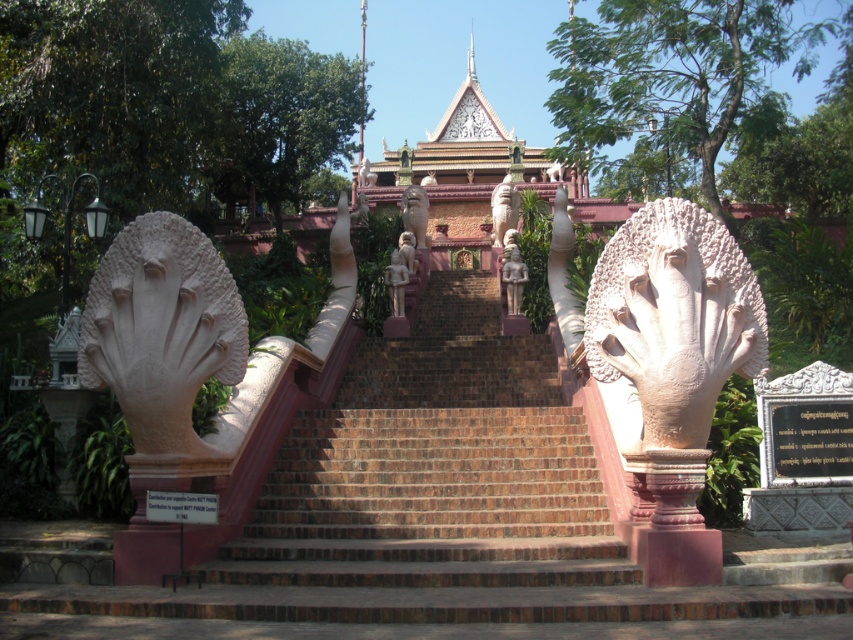
Question: Does polished bronze temple at center come behind white stone statue at center?

Choices:
 (A) yes
 (B) no

Answer: (A)

Question: Is brick stairs at center bigger than smooth stone statue at center?

Choices:
 (A) no
 (B) yes

Answer: (B)

Question: Estimate the real-world distances between objects in this image. Which object is closer to the brick stairs at center?

Choices:
 (A) smooth stone statue at center
 (B) stone statue at center

Answer: (B)

Question: Does brick stairs at center have a smaller size compared to smooth stone statue at center?

Choices:
 (A) no
 (B) yes

Answer: (A)

Question: Estimate the real-world distances between objects in this image. Which object is closer to the white stone hand at center?

Choices:
 (A) stone statue at center
 (B) polished bronze temple at center
 (C) white stone hand at left

Answer: (C)

Question: Among these objects, which one is farthest from the camera?

Choices:
 (A) matte stone statue at center
 (B) polished bronze temple at center
 (C) polished bronze statue at center

Answer: (B)